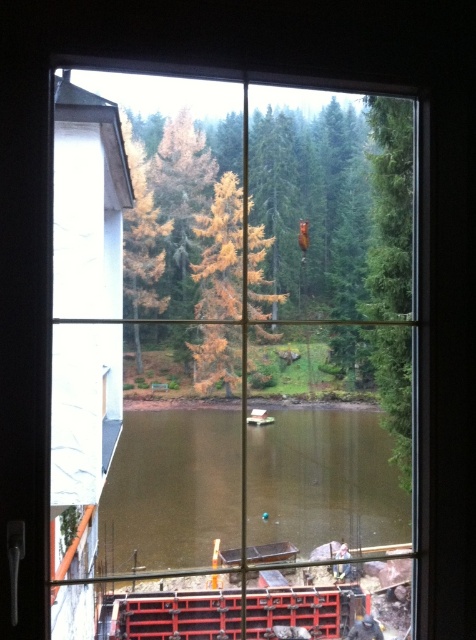
Question: Which object appears farthest from the camera in this image?

Choices:
 (A) brown murky water at center
 (B) transparent glass window at center

Answer: (A)

Question: Does transparent glass window at center appear on the right side of brown murky water at center?

Choices:
 (A) yes
 (B) no

Answer: (A)

Question: Which of the following is the farthest from the observer?

Choices:
 (A) (93, 224)
 (B) (406, 518)

Answer: (B)

Question: Which point is closer to the camera?

Choices:
 (A) brown murky water at center
 (B) transparent glass window at center

Answer: (B)

Question: Is transparent glass window at center closer to the viewer compared to brown murky water at center?

Choices:
 (A) no
 (B) yes

Answer: (B)

Question: Is transparent glass window at center closer to the viewer compared to brown murky water at center?

Choices:
 (A) yes
 (B) no

Answer: (A)